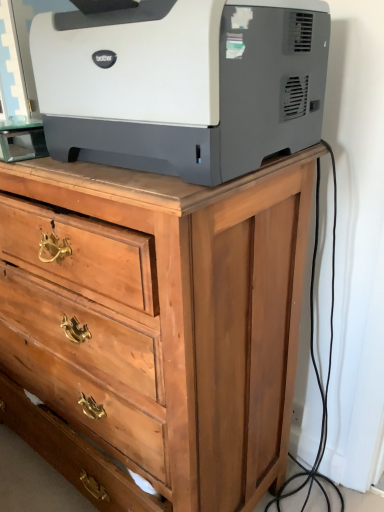
Question: In terms of width, does white matte printer at upper center look wider or thinner when compared to wooden chest of drawers at upper center?

Choices:
 (A) thin
 (B) wide

Answer: (A)

Question: Based on their sizes in the image, would you say white matte printer at upper center is bigger or smaller than wooden chest of drawers at upper center?

Choices:
 (A) big
 (B) small

Answer: (B)

Question: Considering the positions of white matte printer at upper center and wooden chest of drawers at upper center in the image, is white matte printer at upper center taller or shorter than wooden chest of drawers at upper center?

Choices:
 (A) tall
 (B) short

Answer: (B)

Question: From their relative heights in the image, would you say wooden chest of drawers at upper center is taller or shorter than white matte printer at upper center?

Choices:
 (A) short
 (B) tall

Answer: (B)

Question: In terms of size, does wooden chest of drawers at upper center appear bigger or smaller than white matte printer at upper center?

Choices:
 (A) small
 (B) big

Answer: (B)

Question: Is wooden chest of drawers at upper center wider or thinner than white matte printer at upper center?

Choices:
 (A) thin
 (B) wide

Answer: (B)

Question: Is wooden chest of drawers at upper center inside the boundaries of white matte printer at upper center, or outside?

Choices:
 (A) outside
 (B) inside

Answer: (A)